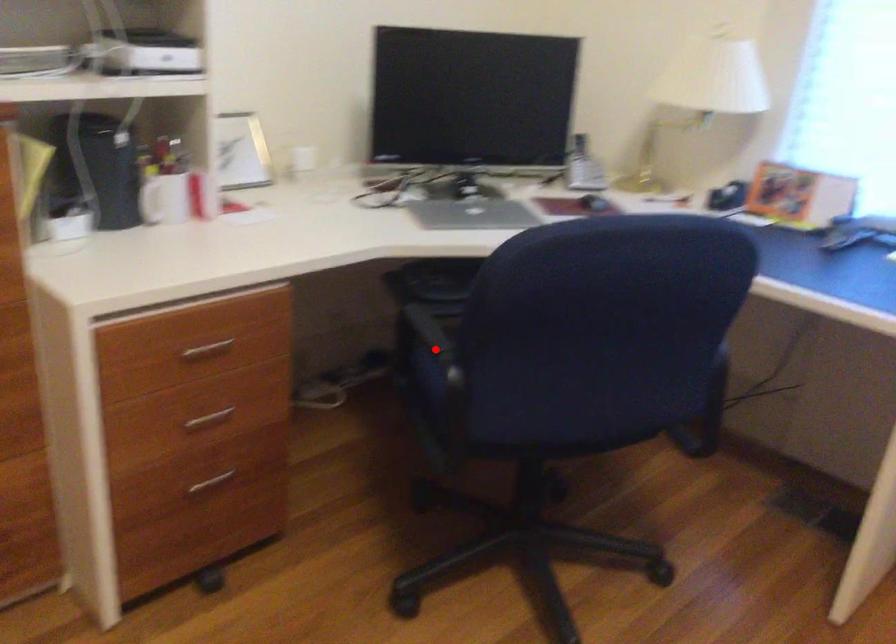
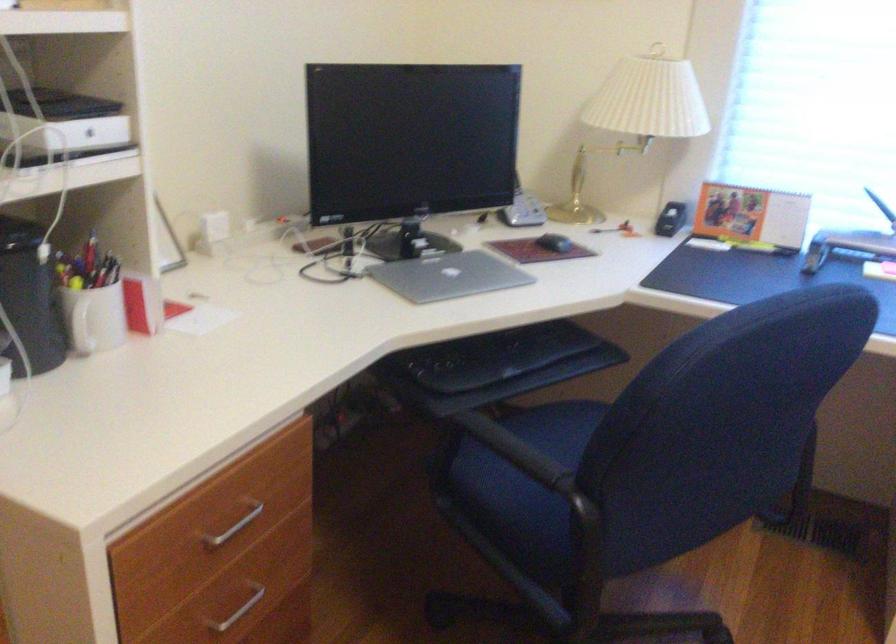
Question: I am providing you with two images of the same scene from different viewpoints. A red point is shown in image1. For the corresponding object point in image2, is it positioned nearer or farther from the camera?

Choices:
 (A) Nearer
 (B) Farther

Answer: (A)